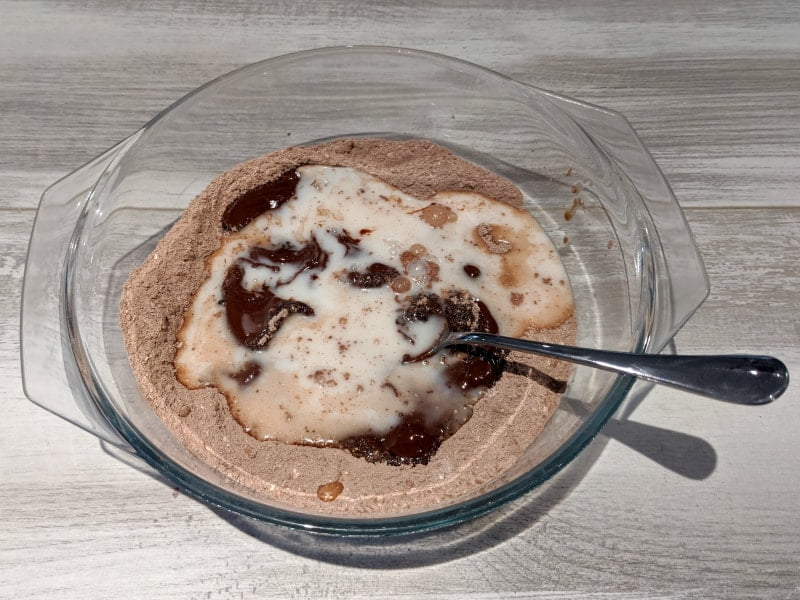
Image resolution: width=800 pixels, height=600 pixels. I want to click on glass bowl, so click(x=258, y=84).